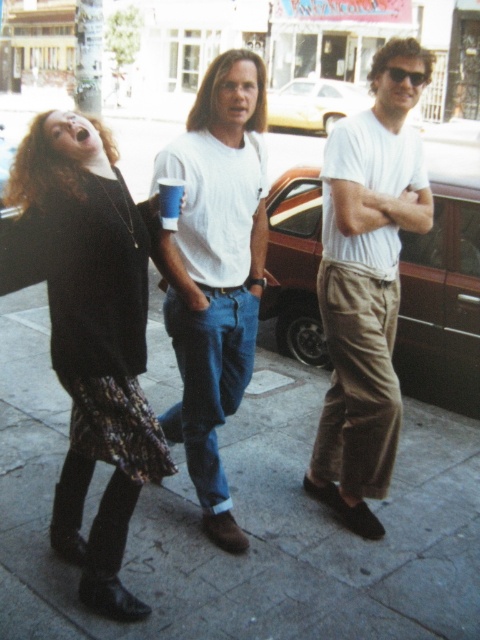
You are a photographer standing at the camera position. You want to take a closeup shot of the black knit sweater at left without moving the camera. Is it possible to do so with a standard zoom lens that has a maximum zoom of 200mm?

The black knit sweater at left is 2.13 meters away from the camera. With a standard zoom lens of 200mm, it is possible to capture a closeup shot of the black knit sweater at left without moving the camera, as the distance is within a typical focal length range for such a lens.